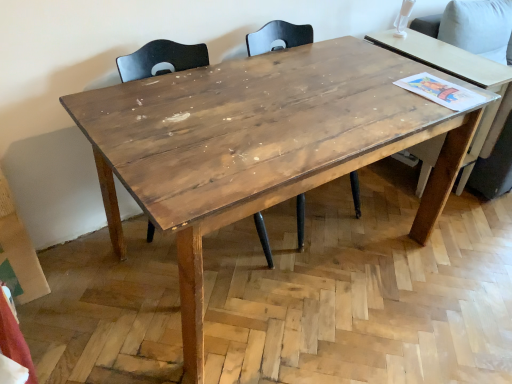
Question: From the image's perspective, would you say wooden table at right is shown under wooden chair at center, which is the first chair in right-to-left order?

Choices:
 (A) yes
 (B) no

Answer: (B)

Question: From a real-world perspective, is wooden table at right under wooden chair at center, which is the first chair in right-to-left order?

Choices:
 (A) no
 (B) yes

Answer: (A)

Question: Considering the relative sizes of wooden table at right and wooden chair at center, marked as the second chair in a left-to-right arrangement, in the image provided, is wooden table at right shorter than wooden chair at center, marked as the second chair in a left-to-right arrangement,?

Choices:
 (A) yes
 (B) no

Answer: (B)

Question: Does wooden table at right have a greater width compared to wooden chair at center, which is the first chair in right-to-left order?

Choices:
 (A) yes
 (B) no

Answer: (A)

Question: Would you say wooden table at right is outside wooden chair at center, marked as the second chair in a left-to-right arrangement?

Choices:
 (A) yes
 (B) no

Answer: (A)

Question: Is wooden table at right oriented towards wooden chair at center, which is the first chair in right-to-left order?

Choices:
 (A) yes
 (B) no

Answer: (B)

Question: Is wooden chair at center, which is the first chair in right-to-left order, shorter than wooden table at right?

Choices:
 (A) yes
 (B) no

Answer: (A)

Question: Is wooden chair at center, marked as the second chair in a left-to-right arrangement, placed right next to wooden table at right?

Choices:
 (A) no
 (B) yes

Answer: (A)

Question: Does wooden chair at center, marked as the second chair in a left-to-right arrangement, come in front of wooden table at right?

Choices:
 (A) yes
 (B) no

Answer: (A)

Question: Can you confirm if wooden chair at center, which is the first chair in right-to-left order, is taller than wooden table at right?

Choices:
 (A) yes
 (B) no

Answer: (B)

Question: From a real-world perspective, is wooden chair at center, marked as the second chair in a left-to-right arrangement, physically below wooden table at right?

Choices:
 (A) no
 (B) yes

Answer: (B)

Question: Is wooden chair at center, which is the first chair in right-to-left order, oriented towards wooden table at right?

Choices:
 (A) no
 (B) yes

Answer: (A)

Question: Can you confirm if wooden chair at center, which appears as the second chair when viewed from the right, is positioned to the left of wooden chair at center, which is the first chair in right-to-left order?

Choices:
 (A) yes
 (B) no

Answer: (A)